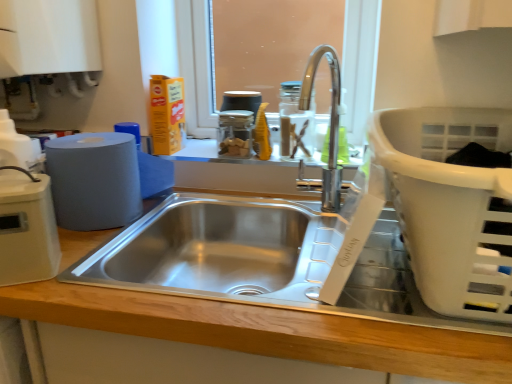
Question: From a real-world perspective, is matte gray paper towel at left under white plastic laundry basket at right?

Choices:
 (A) yes
 (B) no

Answer: (A)

Question: Is matte gray paper towel at left touching white plastic laundry basket at right?

Choices:
 (A) no
 (B) yes

Answer: (A)

Question: Does matte gray paper towel at left have a larger size compared to white plastic laundry basket at right?

Choices:
 (A) no
 (B) yes

Answer: (A)

Question: Is matte gray paper towel at left to the left of white plastic laundry basket at right from the viewer's perspective?

Choices:
 (A) yes
 (B) no

Answer: (A)

Question: Can you confirm if matte gray paper towel at left is smaller than white plastic laundry basket at right?

Choices:
 (A) yes
 (B) no

Answer: (A)

Question: Does matte gray paper towel at left turn towards white plastic laundry basket at right?

Choices:
 (A) yes
 (B) no

Answer: (B)

Question: Is beige plastic toaster at left, acting as the 1th appliance starting from the bottom, not inside clear glass jar at center?

Choices:
 (A) no
 (B) yes

Answer: (B)

Question: Is beige plastic toaster at left, which is the 2th appliance from top to bottom, surrounding clear glass jar at center?

Choices:
 (A) no
 (B) yes

Answer: (A)

Question: Can you confirm if beige plastic toaster at left, which is the second appliance in right-to-left order, is shorter than clear glass jar at center?

Choices:
 (A) no
 (B) yes

Answer: (A)

Question: Does beige plastic toaster at left, which is the second appliance in right-to-left order, have a smaller size compared to clear glass jar at center?

Choices:
 (A) no
 (B) yes

Answer: (A)

Question: Is beige plastic toaster at left, the first appliance when ordered from left to right, to the right of clear glass jar at center from the viewer's perspective?

Choices:
 (A) yes
 (B) no

Answer: (B)

Question: Considering the relative positions of beige plastic toaster at left, which is the second appliance in right-to-left order, and clear glass jar at center in the image provided, is beige plastic toaster at left, which is the second appliance in right-to-left order, in front of clear glass jar at center?

Choices:
 (A) yes
 (B) no

Answer: (A)

Question: Considering the relative positions of clear glass jar at center and transparent glass jar at center, the second appliance from the front, in the image provided, is clear glass jar at center to the left of transparent glass jar at center, the second appliance from the front, from the viewer's perspective?

Choices:
 (A) no
 (B) yes

Answer: (A)